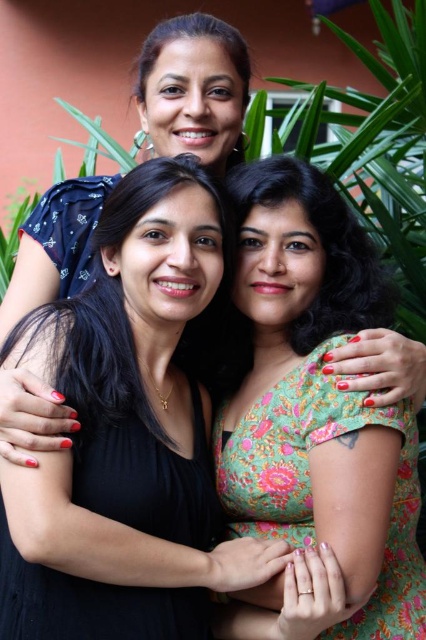
Does black matte dress at center appear under matte blue dress at upper left?

Correct, black matte dress at center is located below matte blue dress at upper left.

Does black matte dress at center appear on the right side of matte blue dress at upper left?

Incorrect, black matte dress at center is not on the right side of matte blue dress at upper left.

Is point (83, 458) farther from viewer compared to point (172, 42)?

No, it is not.

The width and height of the screenshot is (426, 640). What are the coordinates of `black matte dress at center` in the screenshot? It's located at (149, 481).

Is black matte dress at center thinner than floral fabric dress at center?

In fact, black matte dress at center might be wider than floral fabric dress at center.

Does point (204, 456) come closer to viewer compared to point (342, 394)?

No, it is not.

The height and width of the screenshot is (640, 426). Identify the location of black matte dress at center. coord(149,481).

Between matte blue dress at upper left and floral fabric dress at center, which one is positioned higher?

matte blue dress at upper left is higher up.

Is point (388, 372) farther from camera compared to point (311, 406)?

No, (388, 372) is in front of (311, 406).

Identify the location of matte blue dress at upper left. (193, 88).